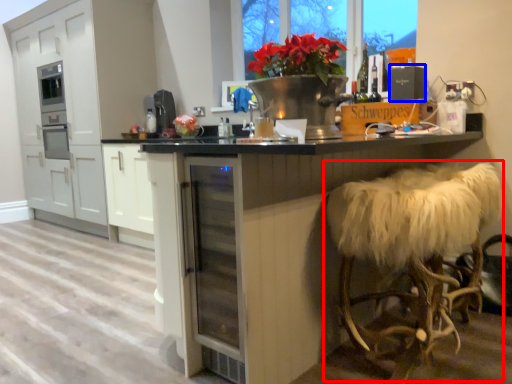
Question: Which point is closer to the camera, swivel chair (highlighted by a red box) or appliance (highlighted by a blue box)?

Choices:
 (A) swivel chair
 (B) appliance

Answer: (A)